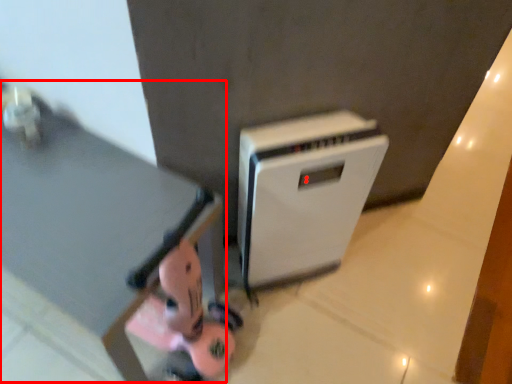
Question: From the image, what is the correct spatial relationship of table (annotated by the red box) in relation to home appliance?

Choices:
 (A) right
 (B) left

Answer: (B)